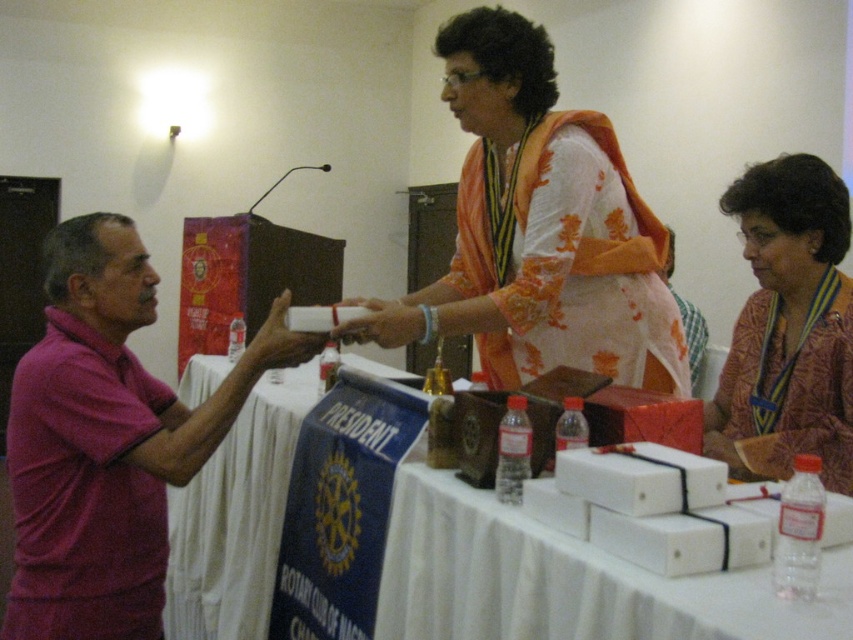
Which is more to the right, patterned fabric scarf at upper right or matte white remote at center?

Positioned to the right is patterned fabric scarf at upper right.

Between patterned fabric scarf at upper right and matte white remote at center, which one has more height?

patterned fabric scarf at upper right is taller.

Which is in front, point (811, 339) or point (421, 324)?

Point (811, 339) is more forward.

I want to click on patterned fabric scarf at upper right, so click(x=788, y=326).

Who is taller, pink shirt at left or matte white remote at center?

Standing taller between the two is pink shirt at left.

Is point (132, 328) less distant than point (370, 312)?

Yes, it is in front of point (370, 312).

Locate an element on the screen. Image resolution: width=853 pixels, height=640 pixels. pink shirt at left is located at coordinates (97, 445).

Which of these two, patterned fabric scarf at upper right or matte white box at center, stands taller?

patterned fabric scarf at upper right

Can you confirm if patterned fabric scarf at upper right is taller than matte white box at center?

Indeed, patterned fabric scarf at upper right has a greater height compared to matte white box at center.

You are a GUI agent. You are given a task and a screenshot of the screen. Output one action in this format:
    pyautogui.click(x=<x>, y=<y>)
    Task: Click on the patterned fabric scarf at upper right
    
    Given the screenshot: What is the action you would take?
    pyautogui.click(x=788, y=326)

Locate an element on the screen. patterned fabric scarf at upper right is located at coordinates (788, 326).